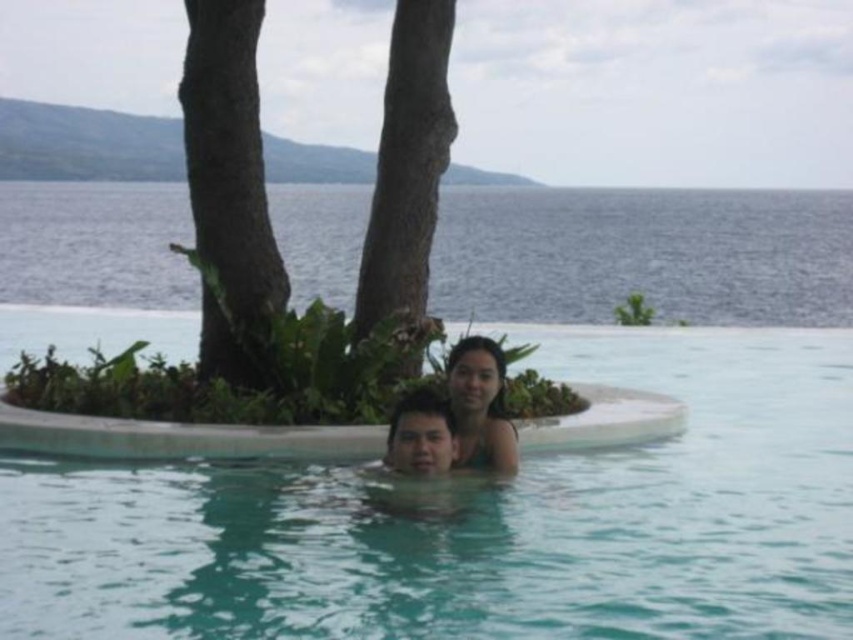
Question: Is brown rough tree trunk at upper left positioned at the back of brown rough tree trunk at upper center?

Choices:
 (A) no
 (B) yes

Answer: (A)

Question: Does brown rough tree trunk at upper left appear over smooth skin woman at center?

Choices:
 (A) yes
 (B) no

Answer: (A)

Question: Among these objects, which one is farthest from the camera?

Choices:
 (A) clear blue water at center
 (B) brown rough tree trunk at upper left
 (C) brown rough tree trunk at upper center

Answer: (C)

Question: Does brown rough tree trunk at upper left lie in front of smooth skin woman at center?

Choices:
 (A) yes
 (B) no

Answer: (B)

Question: Which object is closer to the camera taking this photo?

Choices:
 (A) smooth skin woman at center
 (B) smooth skin man at center
 (C) brown rough tree trunk at upper center
 (D) clear blue water at center

Answer: (D)

Question: Which is nearer to the brown rough tree trunk at upper center?

Choices:
 (A) smooth skin man at center
 (B) clear blue water at center
 (C) smooth skin woman at center
 (D) brown rough tree trunk at upper left

Answer: (D)